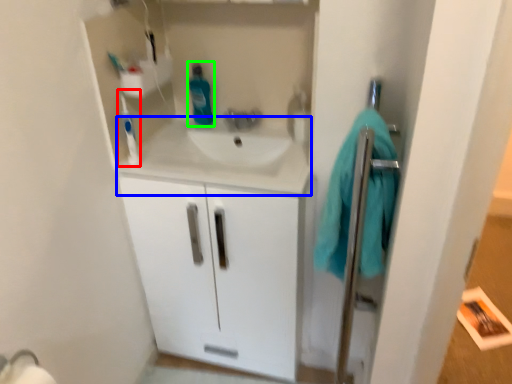
Question: Which object is the closest to the toothbrush (highlighted by a red box)? Choose among these: counter top (highlighted by a blue box) or cleaning product (highlighted by a green box).

Choices:
 (A) counter top
 (B) cleaning product

Answer: (A)